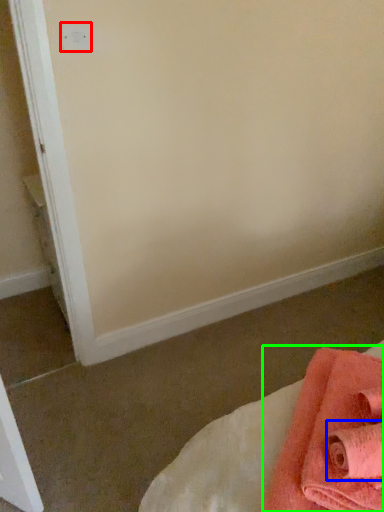
Question: Which object is positioned closest to electric outlet (highlighted by a red box)? Select from bath towel (highlighted by a blue box) and towel (highlighted by a green box).

Choices:
 (A) bath towel
 (B) towel

Answer: (B)